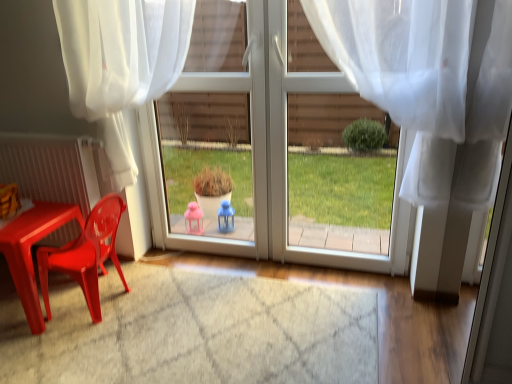
Where is `free space underneath white sheer curtain at upper left, which ranks as the 2th curtain in right-to-left order (from a real-world perspective)`? free space underneath white sheer curtain at upper left, which ranks as the 2th curtain in right-to-left order (from a real-world perspective) is located at coordinates (169, 274).